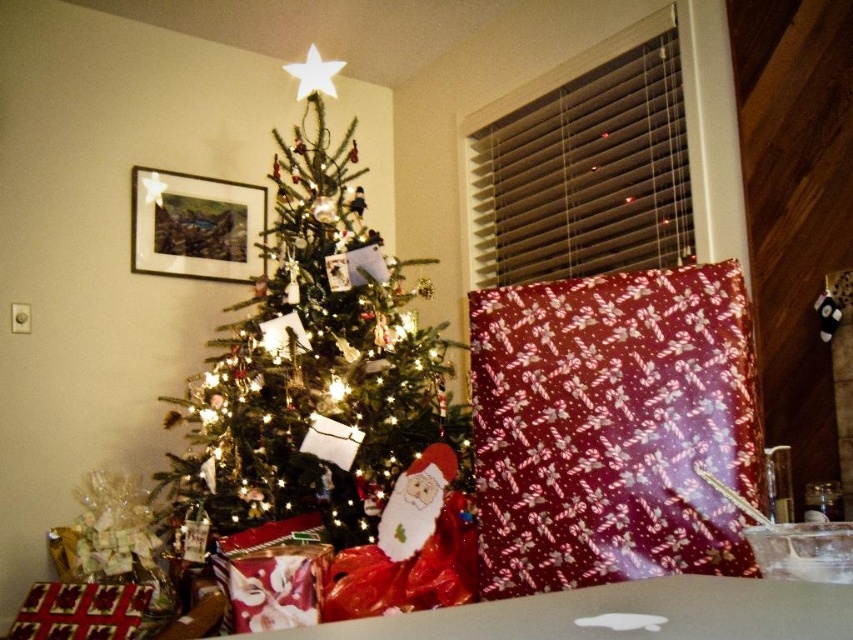
Question: Based on their relative distances, which object is nearer to the green matte christmas tree at center?

Choices:
 (A) felt santa claus at center
 (B) candy cane patterned paper at center

Answer: (A)

Question: Can you confirm if candy cane patterned paper at center is bigger than green matte christmas tree at center?

Choices:
 (A) no
 (B) yes

Answer: (A)

Question: Is candy cane patterned paper at center positioned at the back of green matte christmas tree at center?

Choices:
 (A) yes
 (B) no

Answer: (B)

Question: Considering the real-world distances, which object is farthest from the felt santa claus at center?

Choices:
 (A) candy cane patterned paper at center
 (B) green matte christmas tree at center

Answer: (B)

Question: Observing the image, what is the correct spatial positioning of green matte christmas tree at center in reference to felt santa claus at center?

Choices:
 (A) above
 (B) below

Answer: (A)

Question: Which object appears closest to the camera in this image?

Choices:
 (A) felt santa claus at center
 (B) green matte christmas tree at center

Answer: (A)